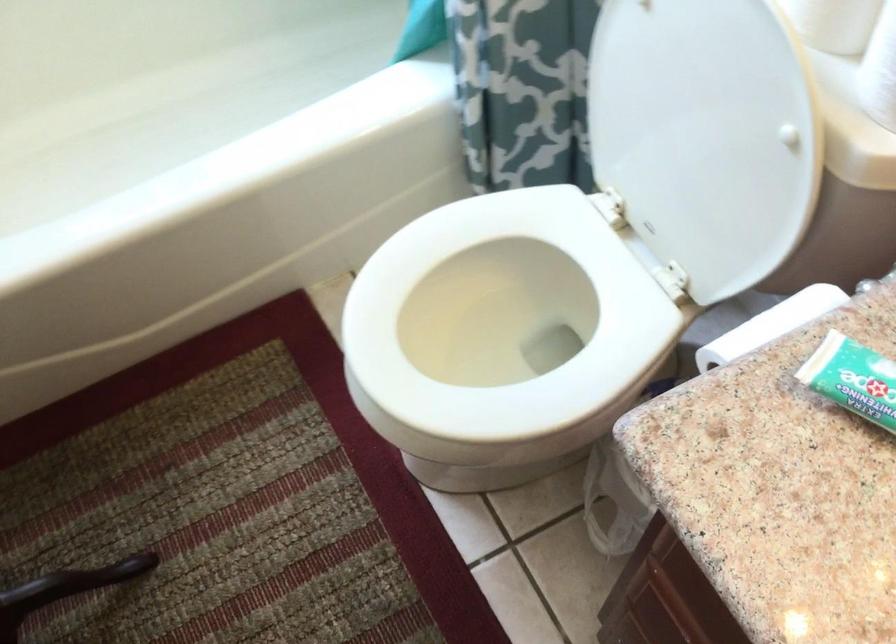
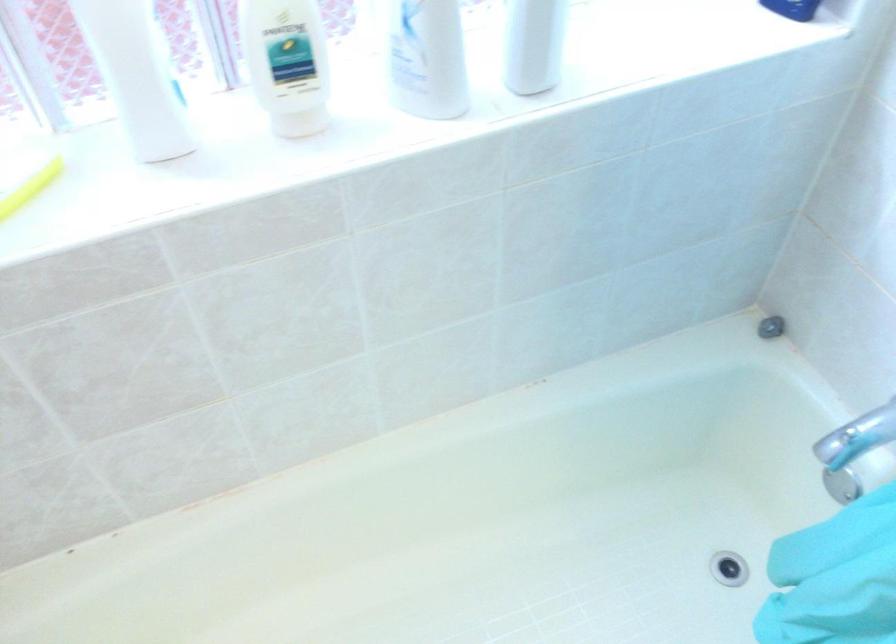
Question: In a continuous first-person perspective shot, in which direction is the camera moving?

Choices:
 (A) Left
 (B) Right
 (C) Forward
 (D) Backward

Answer: (A)